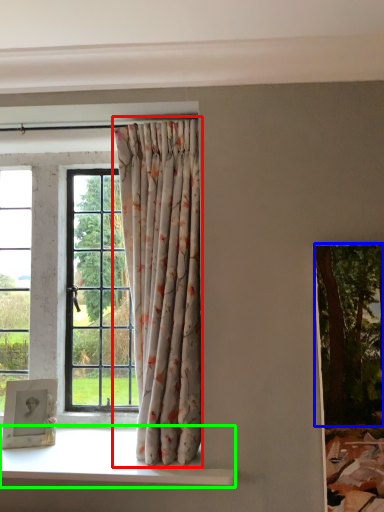
Question: Which object is the closest to the curtain (highlighted by a red box)? Choose among these: tree (highlighted by a blue box) or window sill (highlighted by a green box).

Choices:
 (A) tree
 (B) window sill

Answer: (B)